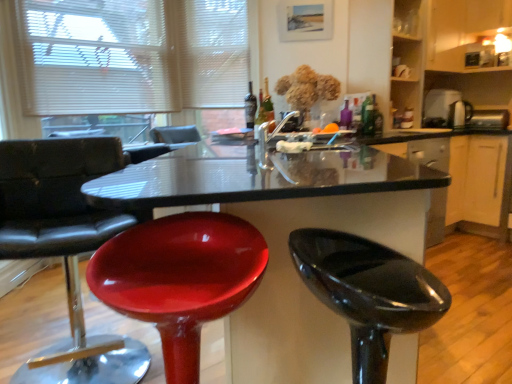
Question: Is metallic silver toaster at upper right, placed as the 3th appliance when sorted from right to left, oriented away from green glass bottle at upper center, placed as the second bottle when sorted from left to right?

Choices:
 (A) yes
 (B) no

Answer: (B)

Question: Is metallic silver toaster at upper right, marked as the first appliance in a left-to-right arrangement, oriented towards green glass bottle at upper center, the 2th bottle viewed from the right?

Choices:
 (A) yes
 (B) no

Answer: (A)

Question: Considering the relative positions of metallic silver toaster at upper right, placed as the 3th appliance when sorted from right to left, and green glass bottle at upper center, which appears as the 3th bottle when viewed from the back, in the image provided, is metallic silver toaster at upper right, placed as the 3th appliance when sorted from right to left, to the right of green glass bottle at upper center, which appears as the 3th bottle when viewed from the back, from the viewer's perspective?

Choices:
 (A) no
 (B) yes

Answer: (B)

Question: Is metallic silver toaster at upper right, marked as the first appliance in a left-to-right arrangement, directly adjacent to green glass bottle at upper center, placed as the second bottle when sorted from left to right?

Choices:
 (A) no
 (B) yes

Answer: (A)

Question: Is metallic silver toaster at upper right, marked as the first appliance in a left-to-right arrangement, not within green glass bottle at upper center, marked as the 1th bottle in a front-to-back arrangement?

Choices:
 (A) yes
 (B) no

Answer: (A)

Question: Based on their sizes in the image, would you say glossy black stool at lower right, the 1th chair viewed from the right, is bigger or smaller than matte glass bottle at center, placed as the 1th bottle when sorted from back to front?

Choices:
 (A) small
 (B) big

Answer: (B)

Question: Looking at their shapes, would you say glossy black stool at lower right, the 1th chair viewed from the right, is wider or thinner than matte glass bottle at center, placed as the 1th bottle when sorted from back to front?

Choices:
 (A) wide
 (B) thin

Answer: (A)

Question: Is glossy black stool at lower right, the 1th chair viewed from the right, in front of or behind matte glass bottle at center, which appears as the third bottle when viewed from the right, in the image?

Choices:
 (A) front
 (B) behind

Answer: (A)

Question: Would you say glossy black stool at lower right, arranged as the 3th chair when viewed from the left, is to the left or to the right of matte glass bottle at center, placed as the 1th bottle when sorted from back to front, in the picture?

Choices:
 (A) right
 (B) left

Answer: (A)

Question: From the image's perspective, relative to metallic silver toaster at upper right, the 2th appliance from the left, is glossy plastic stool at center, the second chair in the right-to-left sequence, above or below?

Choices:
 (A) below
 (B) above

Answer: (A)

Question: Based on their positions, is glossy plastic stool at center, the second chair in the right-to-left sequence, located to the left or right of metallic silver toaster at upper right, which appears as the second appliance when viewed from the right?

Choices:
 (A) left
 (B) right

Answer: (A)

Question: Relative to metallic silver toaster at upper right, the 2th appliance from the left, is glossy plastic stool at center, the second chair in the right-to-left sequence, in front or behind?

Choices:
 (A) behind
 (B) front

Answer: (B)

Question: Looking at the image, does glossy plastic stool at center, the second chair in the right-to-left sequence, seem bigger or smaller compared to metallic silver toaster at upper right, the 2th appliance from the left?

Choices:
 (A) small
 (B) big

Answer: (B)

Question: Looking at their shapes, would you say black glossy counter at right is wider or thinner than green glass bottle at upper center, marked as the 1th bottle in a front-to-back arrangement?

Choices:
 (A) thin
 (B) wide

Answer: (B)

Question: Is black glossy counter at right bigger or smaller than green glass bottle at upper center, the 2th bottle viewed from the right?

Choices:
 (A) big
 (B) small

Answer: (A)